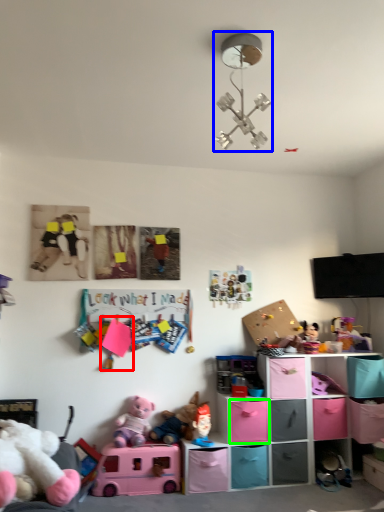
Question: Which is nearer to the toy (highlighted by a red box)? light fixture (highlighted by a blue box) or shelf (highlighted by a green box).

Choices:
 (A) light fixture
 (B) shelf

Answer: (B)